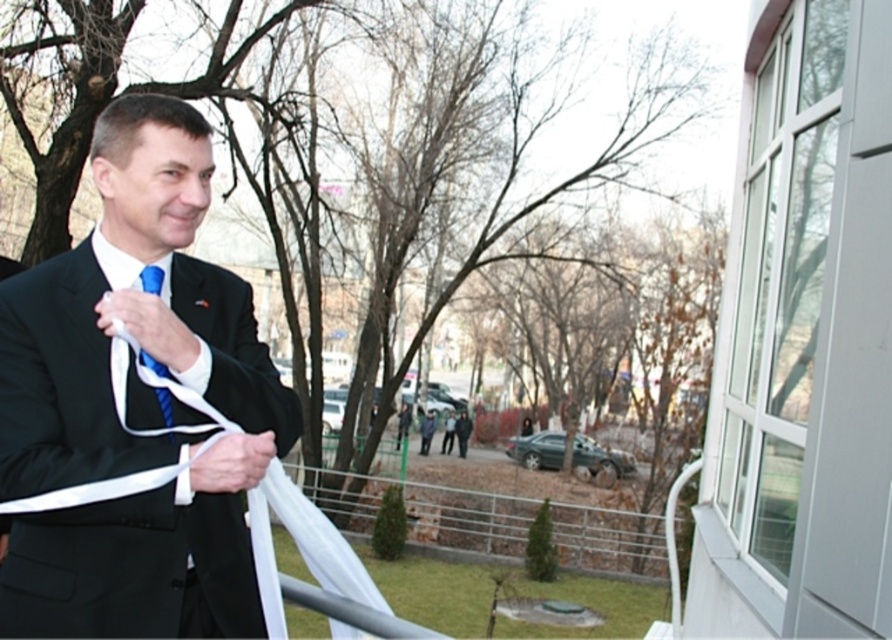
You are a photographer at a ribbon cutting ceremony. You need to focus your camera on the matte black suit at center and the blue textured tie at center. Which object should you adjust your focus on first if you want to ensure both are in focus, given their sizes?

The matte black suit at center is bigger than the blue textured tie at center, so you should focus on the larger matte black suit at center first to ensure both are in focus.

You are a photographer at a ribbon cutting ceremony. You want to capture a close up of the man in the matte black suit at center and blue textured tie at center. What is the minimum distance you need to maintain between the camera and the subject to ensure both items are in focus?

The minimum distance you need to maintain is 7.61 inches between the matte black suit at center and blue textured tie at center to ensure both are in focus.

You are a photographer at a ribbon cutting ceremony. You want to take a photo of the man in the matte black suit at center and the blue textured tie at center. Which object will appear larger in the photo?

The matte black suit at center will appear larger in the photo because it is closer to the viewer than the blue textured tie at center.